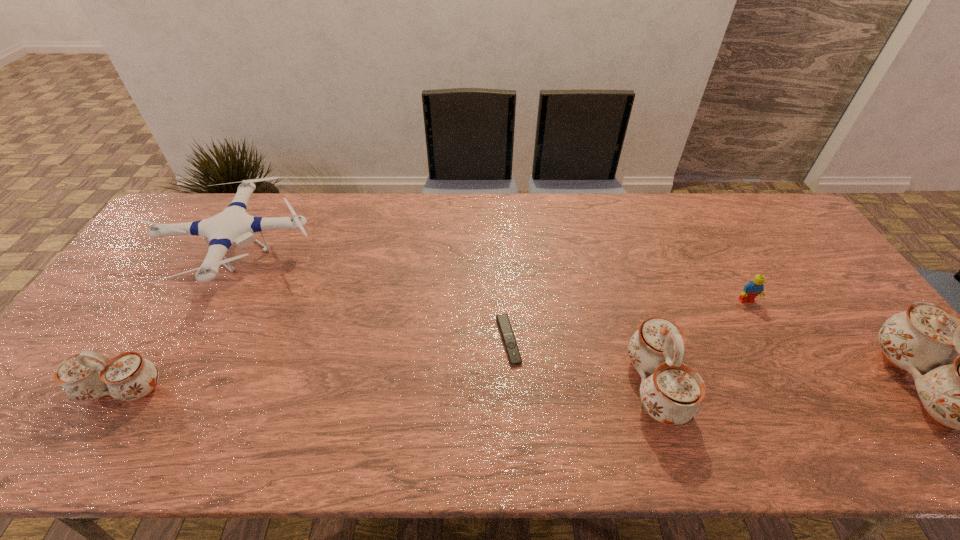
If equal spacing is the goal by inserting an additional chinaware among them, please point out a vacant space for this new chinaware. Please provide its 2D coordinates. Your answer should be formatted as a tuple, i.e. [(x, y)], where the tuple contains the x and y coordinates of a point satisfying the conditions above.

[(390, 388)]